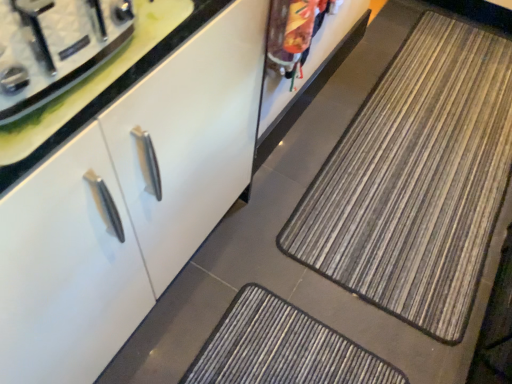
Describe the element at coordinates (416, 180) in the screenshot. I see `striped fabric mat at center` at that location.

What is the approximate height of white glossy cabinet at center?

36.04 inches.

Where is `brushed metal stove top at upper left`? brushed metal stove top at upper left is located at coordinates (55, 47).

Is brushed metal stove top at upper left next to white glossy cabinet at center?

No, brushed metal stove top at upper left is not in contact with white glossy cabinet at center.

Does brushed metal stove top at upper left appear on the right side of white glossy cabinet at center?

Yes.

Does point (80, 53) lie in front of point (225, 49)?

That is True.

In the scene shown: Is brushed metal stove top at upper left oriented away from white glossy cabinet at center?

No.

Considering the relative sizes of white glossy cabinet at center and striped fabric mat at center in the image provided, is white glossy cabinet at center taller than striped fabric mat at center?

Correct, white glossy cabinet at center is much taller as striped fabric mat at center.

Based on their sizes in the image, would you say white glossy cabinet at center is bigger or smaller than striped fabric mat at center?

Clearly, white glossy cabinet at center is larger in size than striped fabric mat at center.

Between white glossy cabinet at center and striped fabric mat at center, which one is positioned in front?

white glossy cabinet at center is closer to the camera.

Does striped fabric mat at center have a smaller size compared to brushed metal stove top at upper left?

No.

Does striped fabric mat at center have a greater width compared to brushed metal stove top at upper left?

Correct, the width of striped fabric mat at center exceeds that of brushed metal stove top at upper left.

Is striped fabric mat at center positioned behind brushed metal stove top at upper left?

Yes, striped fabric mat at center is further from the camera.

Does striped fabric mat at center have a greater height compared to white glossy cabinet at center?

No.

Find the location of a particular element. Image resolution: width=512 pixels, height=384 pixels. mat on the right of white glossy cabinet at center is located at coordinates (416, 180).

How many degrees apart are the facing directions of striped fabric mat at center and white glossy cabinet at center?

They differ by 89.9 degrees in their facing directions.

Does striped fabric mat at center lie behind white glossy cabinet at center?

Yes.

Considering the positions of point (85, 4) and point (489, 33), is point (85, 4) closer or farther from the camera than point (489, 33)?

Point (85, 4) is positioned closer to the camera compared to point (489, 33).

Is brushed metal stove top at upper left looking in the opposite direction of striped fabric mat at center?

brushed metal stove top at upper left is not turned away from striped fabric mat at center.

Looking at this image, considering the positions of objects brushed metal stove top at upper left and striped fabric mat at center in the image provided, who is more to the right, brushed metal stove top at upper left or striped fabric mat at center?

striped fabric mat at center is more to the right.

Considering the sizes of brushed metal stove top at upper left and striped fabric mat at center in the image, is brushed metal stove top at upper left bigger or smaller than striped fabric mat at center?

In the image, brushed metal stove top at upper left appears to be smaller than striped fabric mat at center.

Between white glossy cabinet at center and brushed metal stove top at upper left, which one has smaller size?

With smaller size is brushed metal stove top at upper left.

Which object is positioned more to the right, white glossy cabinet at center or brushed metal stove top at upper left?

brushed metal stove top at upper left.

Considering the points (114, 253) and (14, 0), which point is behind, point (114, 253) or point (14, 0)?

The point (114, 253) is farther from the camera.

This screenshot has width=512, height=384. I want to click on appliance behind the white glossy cabinet at center, so click(55, 47).

Identify the location of appliance lying above the white glossy cabinet at center (from the image's perspective). The image size is (512, 384). (55, 47).

Where is `cabinetry located in front of the striped fabric mat at center`? cabinetry located in front of the striped fabric mat at center is located at coordinates (125, 202).

Based on their spatial positions, is brushed metal stove top at upper left or white glossy cabinet at center closer to striped fabric mat at center?

The object closer to striped fabric mat at center is white glossy cabinet at center.

Based on their spatial positions, is brushed metal stove top at upper left or striped fabric mat at center closer to white glossy cabinet at center?

Based on the image, brushed metal stove top at upper left appears to be nearer to white glossy cabinet at center.

From the image, which object appears to be farther from brushed metal stove top at upper left, white glossy cabinet at center or striped fabric mat at center?

The object further to brushed metal stove top at upper left is striped fabric mat at center.

Consider the image. Based on their spatial positions, is white glossy cabinet at center or brushed metal stove top at upper left further from striped fabric mat at center?

Among the two, brushed metal stove top at upper left is located further to striped fabric mat at center.

Considering their positions, is striped fabric mat at center positioned closer to brushed metal stove top at upper left than white glossy cabinet at center?

The object closer to brushed metal stove top at upper left is white glossy cabinet at center.

Based on the photo, when comparing their distances from white glossy cabinet at center, does striped fabric mat at center or brushed metal stove top at upper left seem closer?

Based on the image, brushed metal stove top at upper left appears to be nearer to white glossy cabinet at center.

You are a GUI agent. You are given a task and a screenshot of the screen. Output one action in this format:
    pyautogui.click(x=<x>, y=<y>)
    Task: Click on the appliance between white glossy cabinet at center and striped fabric mat at center from left to right
    
    Given the screenshot: What is the action you would take?
    pyautogui.click(x=55, y=47)